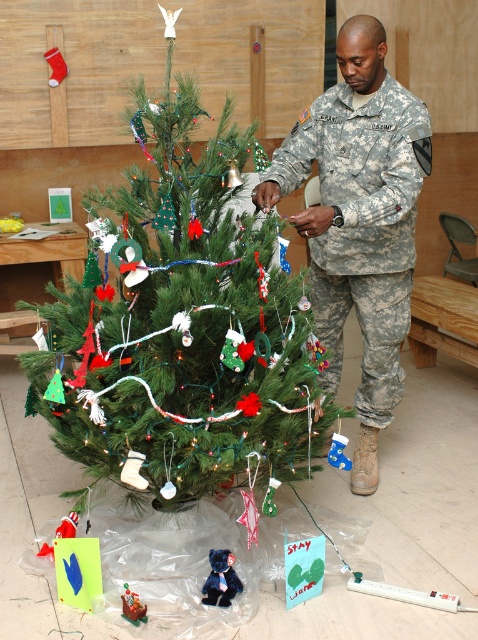
You are standing in front of the Christmas tree and want to place a gift exactly at the point marked as point (199, 356). If you are currently 2 meters away from the tree, can you reach that point without moving closer?

The point (199, 356) is 1.94 meters from the camera. Since you are currently 2 meters away from the tree, you can reach that point without moving closer as it is slightly closer than your current position.

Looking at this image, you are a child looking for your gifts under the Christmas tree. You see the camouflage uniform at center and the plush red santa at lower left. Which gift is closer to you?

The camouflage uniform at center is closer to you because the plush red santa at lower left is behind it.